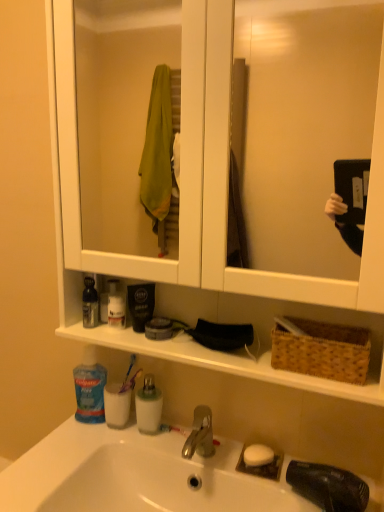
You are a GUI agent. You are given a task and a screenshot of the screen. Output one action in this format:
    pyautogui.click(x=<x>, y=<y>)
    Task: Click on the vacant space to the right of clear plastic container at center
    
    Given the screenshot: What is the action you would take?
    (197, 446)